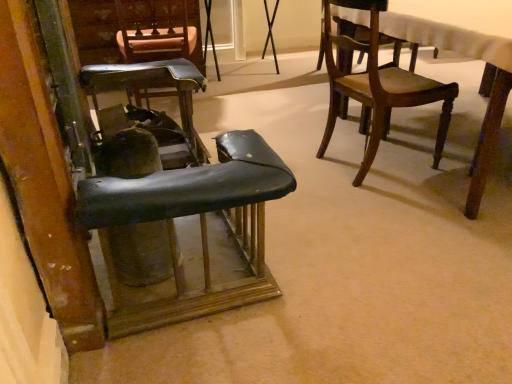
Question: Is point (413, 89) closer or farther from the camera than point (174, 59)?

Choices:
 (A) closer
 (B) farther

Answer: (A)

Question: Based on their positions, is wooden chair at upper right, which is the 4th chair from left to right, located to the left or right of leather-like black chair at center-left, the 3th chair positioned from the right?

Choices:
 (A) left
 (B) right

Answer: (B)

Question: Considering the real-world distances, which object is farthest from the leather-like brown chair at upper center, which is the 4th chair in right-to-left order?

Choices:
 (A) wooden chair at upper right, the 1th chair from the right
 (B) leather-like black chair at left, which is counted as the third chair, starting from the left
 (C) leather-like black chair at center-left, the 3th chair positioned from the right

Answer: (B)

Question: Which object is positioned farthest from the leather-like black chair at center-left, the 3th chair positioned from the right?

Choices:
 (A) leather-like brown chair at upper center, which is the 4th chair in right-to-left order
 (B) leather-like black chair at left, the second chair positioned from the right
 (C) wooden chair at upper right, the 1th chair from the right

Answer: (B)